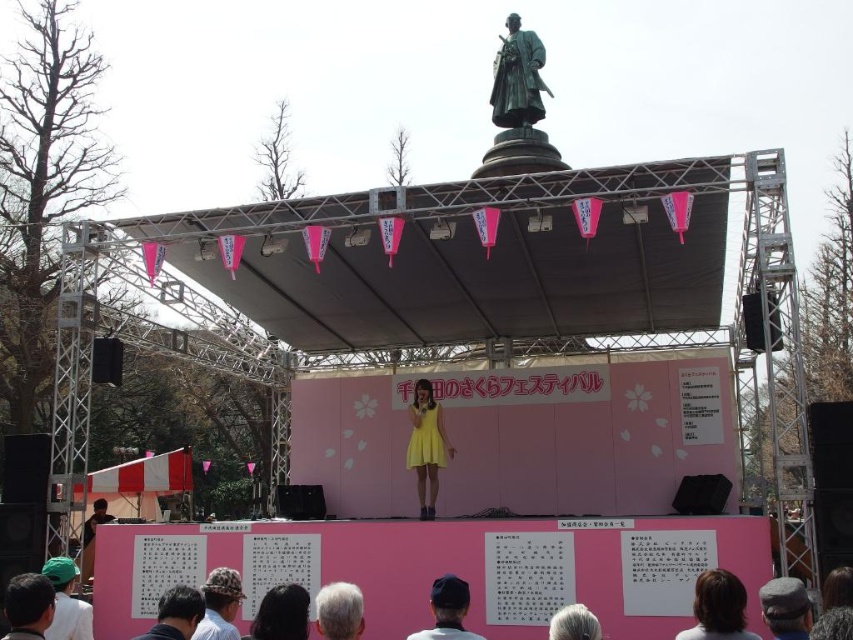
Is bronze statue at upper center bigger than gray hair at lower center?

Correct, bronze statue at upper center is larger in size than gray hair at lower center.

Is bronze statue at upper center shorter than gray hair at lower center?

No, bronze statue at upper center is not shorter than gray hair at lower center.

Identify the location of bronze statue at upper center. This screenshot has height=640, width=853. click(517, 77).

Does green polished bronze statue at upper center have a greater width compared to dark brown hair at lower left?

Yes, green polished bronze statue at upper center is wider than dark brown hair at lower left.

Which is in front, point (537, 74) or point (53, 596)?

Point (53, 596) is in front.

This screenshot has height=640, width=853. I want to click on green polished bronze statue at upper center, so click(x=518, y=108).

Does dark gray fabric hat at lower center have a lesser width compared to gray fabric hat at lower right?

No.

Is point (192, 624) closer to viewer compared to point (833, 573)?

Yes, point (192, 624) is closer to viewer.

The image size is (853, 640). What do you see at coordinates (177, 614) in the screenshot?
I see `dark gray fabric hat at lower center` at bounding box center [177, 614].

Locate an element on the screen. The width and height of the screenshot is (853, 640). dark gray fabric hat at lower center is located at coordinates (177, 614).